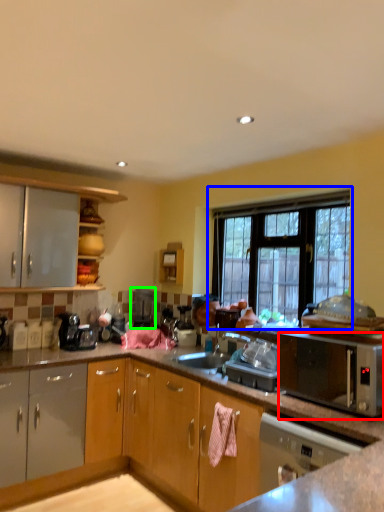
Question: Estimate the real-world distances between objects in this image. Which object is farther from microwave oven (highlighted by a red box), window (highlighted by a blue box) or appliance (highlighted by a green box)?

Choices:
 (A) window
 (B) appliance

Answer: (B)